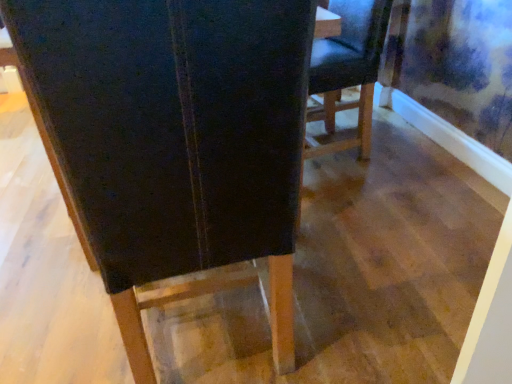
The width and height of the screenshot is (512, 384). I want to click on vacant region to the left of black leather chair at center, arranged as the second chair when viewed from the back, so click(x=62, y=317).